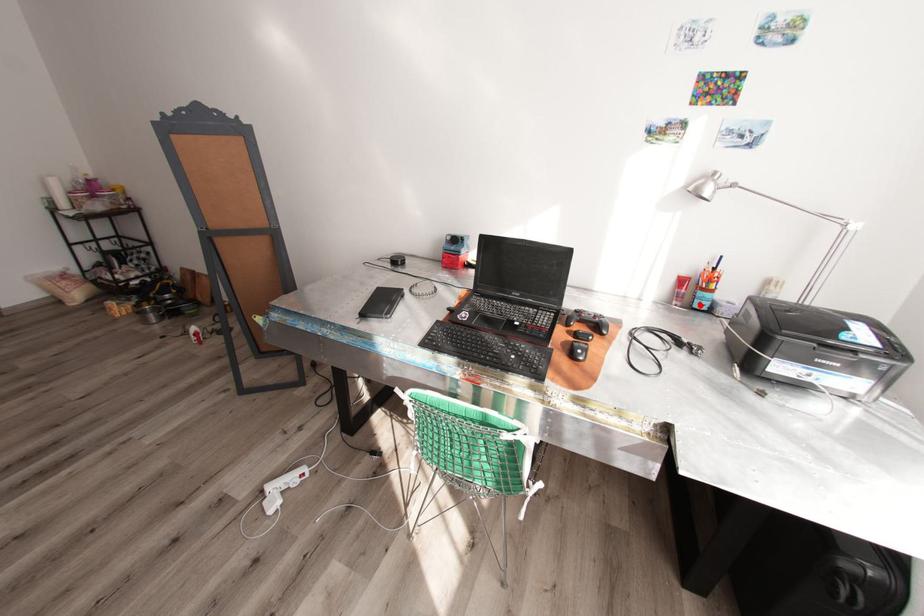
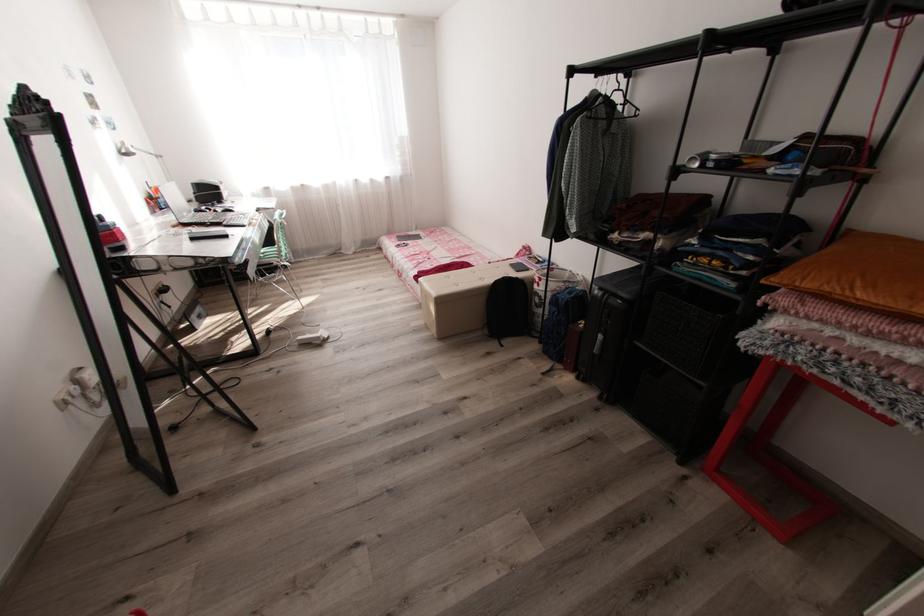
The point at the highlighted location is marked in the first image. Where is the corresponding point in the second image?

(167, 207)